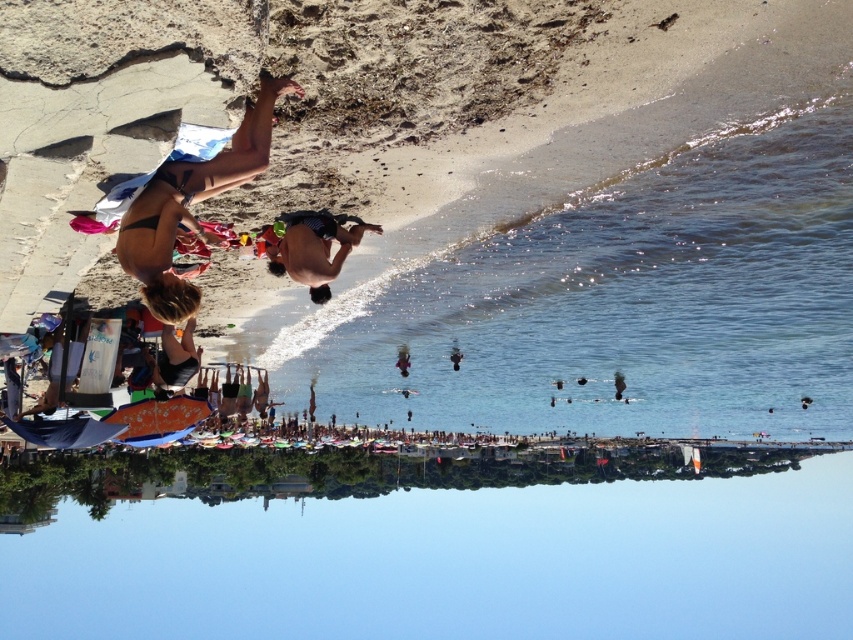
Does point (479, 282) come behind point (177, 317)?

Yes, point (479, 282) is behind point (177, 317).

Does clear blue water at upper right have a smaller size compared to black bikini at upper left?

No, clear blue water at upper right is not smaller than black bikini at upper left.

Who is more distant from viewer, (761,256) or (149,266)?

The point (761,256) is behind.

Where is `clear blue water at upper right`? This screenshot has width=853, height=640. clear blue water at upper right is located at coordinates (606, 298).

Is point (660, 205) positioned in front of point (283, 234)?

No, (660, 205) is behind (283, 234).

Between point (795, 209) and point (292, 268), which one is positioned in front?

Positioned in front is point (292, 268).

Where is `clear blue water at upper right`? Image resolution: width=853 pixels, height=640 pixels. clear blue water at upper right is located at coordinates (606, 298).

Who is more distant from viewer, [180,292] or [192,358]?

Point [192,358]

Who is more forward, [173,192] or [165,353]?

Point [173,192]

Find the location of a particular element. black bikini at upper left is located at coordinates (189, 204).